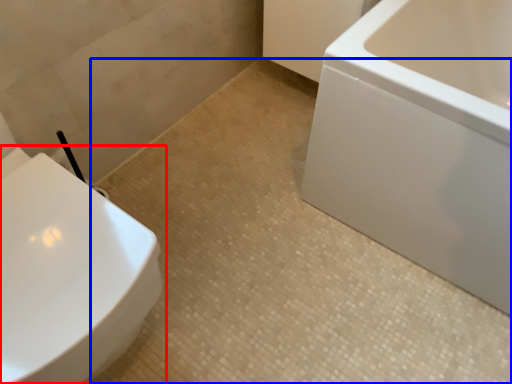
Question: Among these objects, which one is farthest to the camera, toilet (highlighted by a red box) or ceramic tile (highlighted by a blue box)?

Choices:
 (A) toilet
 (B) ceramic tile

Answer: (B)